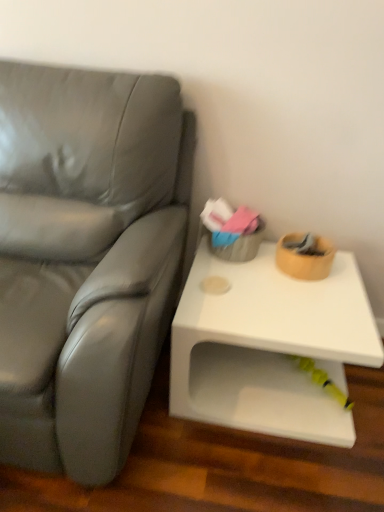
This screenshot has width=384, height=512. Find the location of `free point in front of white glossy table at right`. free point in front of white glossy table at right is located at coordinates (253, 468).